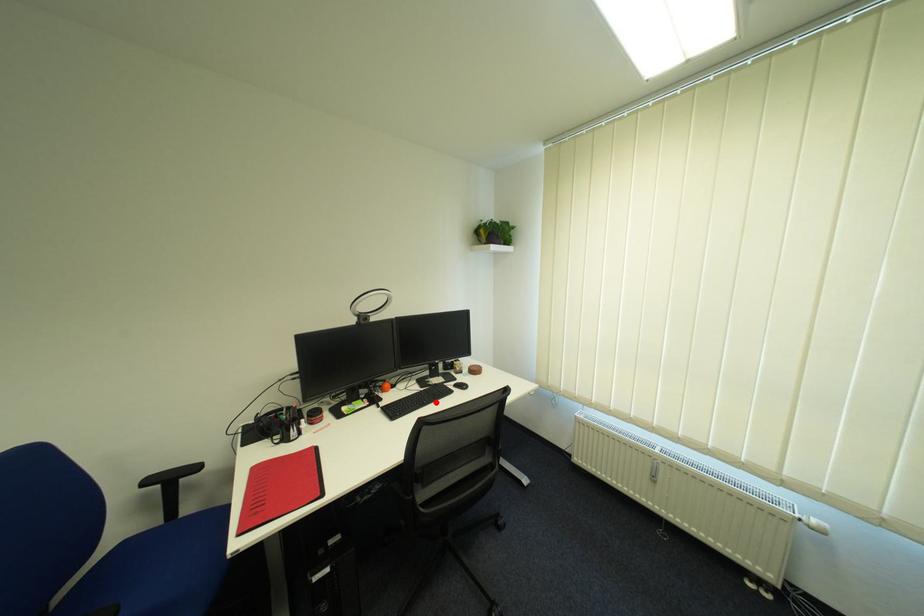
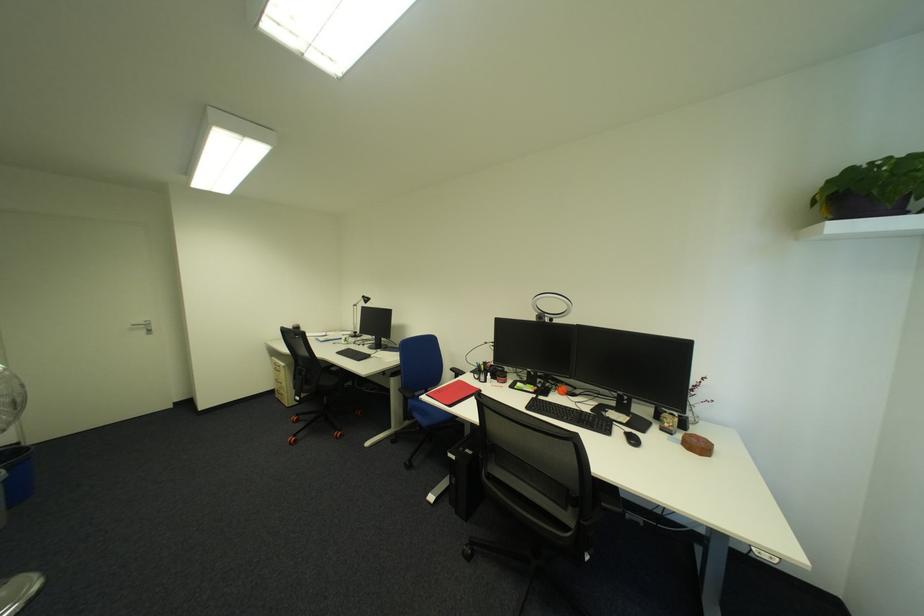
Where in the second image is the point corresponding to the highlighted location from the first image?

(577, 419)